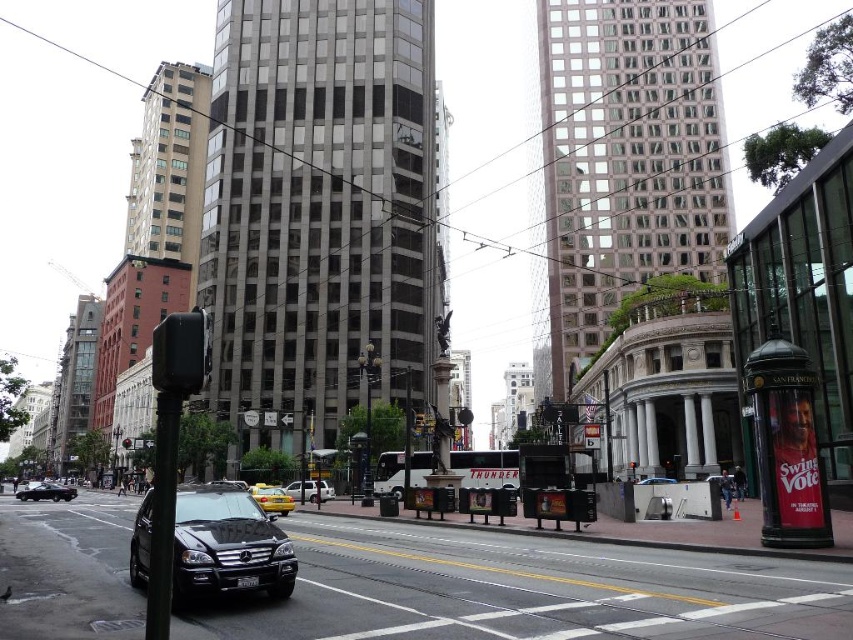
Question: Which of the following is the closest to the observer?

Choices:
 (A) (123, 440)
 (B) (274, 488)
 (C) (62, 496)

Answer: (B)

Question: Is shiny black sedan at lower left smaller than metallic silver sedan at center?

Choices:
 (A) no
 (B) yes

Answer: (A)

Question: Can you confirm if shiny black sedan at lower left is positioned below metallic silver sedan at center?

Choices:
 (A) no
 (B) yes

Answer: (B)

Question: Which point is farther from the camera taking this photo?

Choices:
 (A) (131, 445)
 (B) (65, 486)
 (C) (321, 488)
 (D) (637, 481)

Answer: (A)

Question: Can you confirm if metallic silver sedan at center is positioned above black glossy sedan at center?

Choices:
 (A) yes
 (B) no

Answer: (B)

Question: Which point is closer to the camera?

Choices:
 (A) (230, 490)
 (B) (57, 490)

Answer: (A)